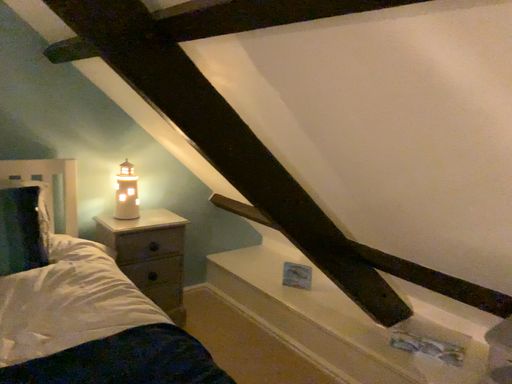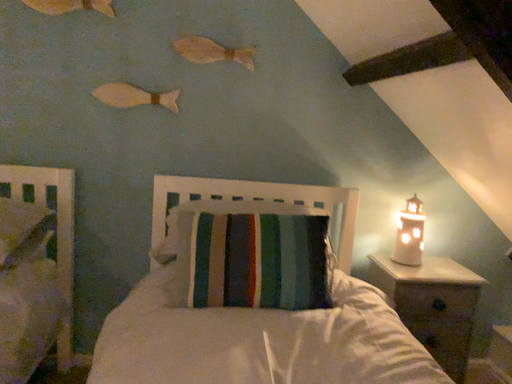
Question: How did the camera likely rotate when shooting the video?

Choices:
 (A) rotated downward
 (B) rotated upward

Answer: (B)